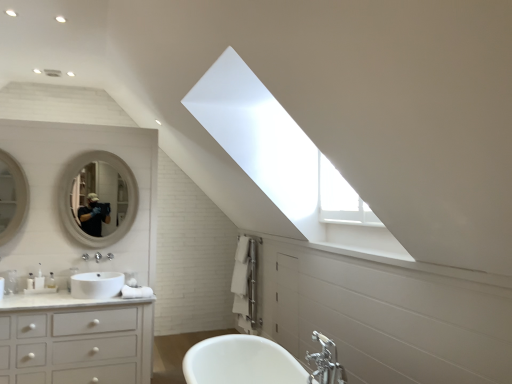
Question: Is white glossy sink at lower left completely or partially inside white glossy bathtub at center?

Choices:
 (A) yes
 (B) no

Answer: (B)

Question: Can you confirm if white glossy bathtub at center is shorter than white glossy sink at lower left?

Choices:
 (A) no
 (B) yes

Answer: (B)

Question: Can you see white glossy bathtub at center touching white glossy sink at lower left?

Choices:
 (A) no
 (B) yes

Answer: (A)

Question: Is white glossy bathtub at center positioned beyond the bounds of white glossy sink at lower left?

Choices:
 (A) no
 (B) yes

Answer: (B)

Question: Does white glossy bathtub at center have a greater width compared to white glossy sink at lower left?

Choices:
 (A) no
 (B) yes

Answer: (B)

Question: Considering the positions of white glossy sink at lower left and white glossy mirror at upper left, acting as the 1th mirror starting from the back, in the image, is white glossy sink at lower left wider or thinner than white glossy mirror at upper left, acting as the 1th mirror starting from the back,?

Choices:
 (A) wide
 (B) thin

Answer: (A)

Question: Considering their positions, is white glossy sink at lower left located in front of or behind white glossy mirror at upper left, which ranks as the 2th mirror in front-to-back order?

Choices:
 (A) behind
 (B) front

Answer: (B)

Question: Is white glossy sink at lower left to the left or to the right of white glossy mirror at upper left, the 2th mirror when ordered from left to right, in the image?

Choices:
 (A) left
 (B) right

Answer: (B)

Question: Is white glossy sink at lower left bigger or smaller than white glossy mirror at upper left, acting as the 1th mirror starting from the back?

Choices:
 (A) big
 (B) small

Answer: (B)

Question: From the image's perspective, is white glossy mirror at upper left, which ranks as the 2th mirror in front-to-back order, positioned above or below matte white mirror at left, which is the 2th mirror from back to front?

Choices:
 (A) below
 (B) above

Answer: (A)

Question: Is white glossy mirror at upper left, the 2th mirror when ordered from left to right, bigger or smaller than matte white mirror at left, the 1th mirror positioned from the front?

Choices:
 (A) big
 (B) small

Answer: (A)

Question: Is point pyautogui.click(x=110, y=220) closer or farther from the camera than point pyautogui.click(x=10, y=192)?

Choices:
 (A) farther
 (B) closer

Answer: (A)

Question: Is white glossy mirror at upper left, acting as the 1th mirror starting from the back, spatially inside matte white mirror at left, which is the 2th mirror from back to front, or outside of it?

Choices:
 (A) outside
 (B) inside

Answer: (A)

Question: In terms of size, does white glossy bathtub at center appear bigger or smaller than matte white mirror at left, the 1th mirror positioned from the front?

Choices:
 (A) big
 (B) small

Answer: (A)

Question: From their relative heights in the image, would you say white glossy bathtub at center is taller or shorter than matte white mirror at left, acting as the first mirror starting from the left?

Choices:
 (A) tall
 (B) short

Answer: (B)